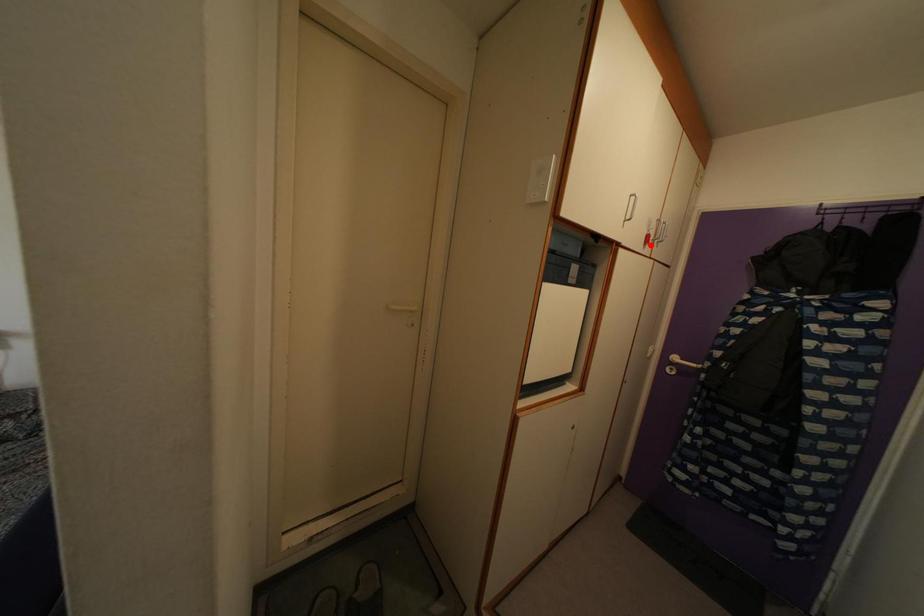
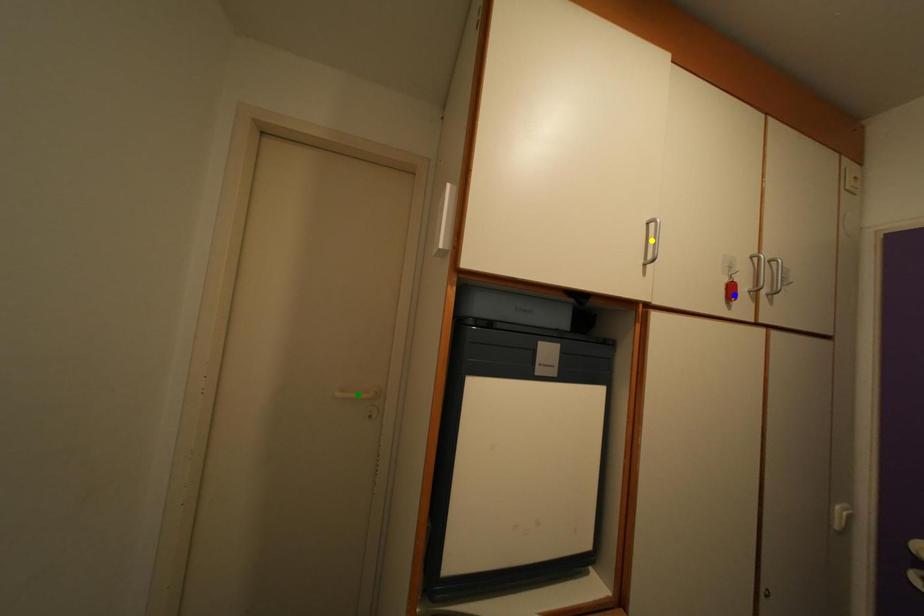
Question: I am providing you with two images of the same scene from different viewpoints. A red point is marked on the first image. You are given multiple points on the second image. Which point in image 2 represents the same 3d spot as the red point in image 1?

Choices:
 (A) yellow point
 (B) blue point
 (C) green point

Answer: (B)